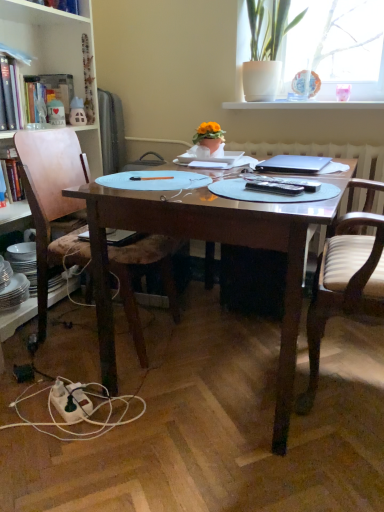
I want to click on free space in front of white plastic power outlet at lower left, so click(x=57, y=443).